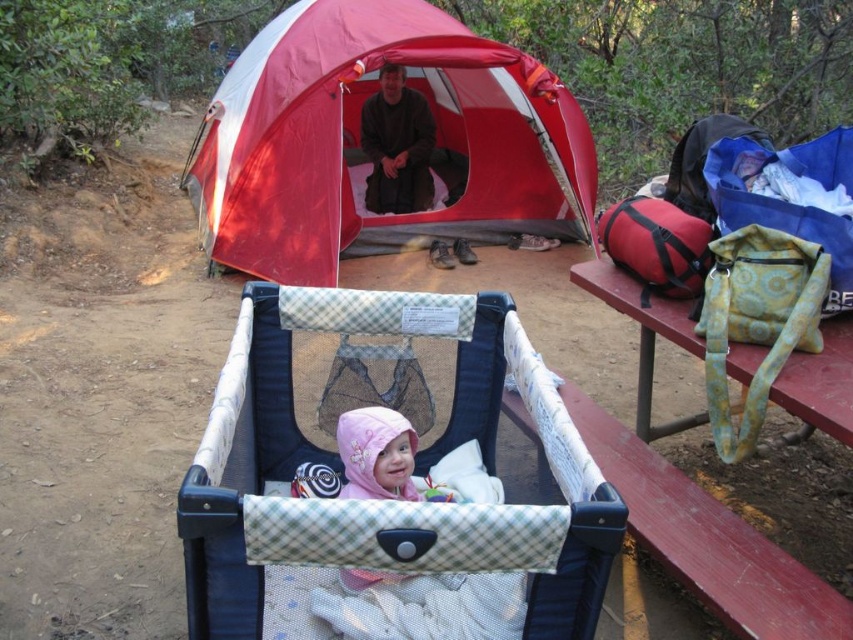
Question: Which object is positioned farthest from the blue fabric playpen at center?

Choices:
 (A) red/white fabric tent at upper center
 (B) wooden picnic table at right

Answer: (A)

Question: Which object is the closest to the wooden picnic table at right?

Choices:
 (A) red/white fabric tent at upper center
 (B) blue fabric playpen at center

Answer: (B)

Question: Considering the real-world distances, which object is closest to the wooden picnic table at right?

Choices:
 (A) red/white fabric tent at upper center
 (B) blue fabric playpen at center

Answer: (B)

Question: Does blue fabric playpen at center have a greater width compared to red/white fabric tent at upper center?

Choices:
 (A) no
 (B) yes

Answer: (A)

Question: In this image, where is blue fabric playpen at center located relative to red/white fabric tent at upper center?

Choices:
 (A) above
 (B) below

Answer: (B)

Question: From the image, what is the correct spatial relationship of blue fabric playpen at center in relation to red/white fabric tent at upper center?

Choices:
 (A) above
 (B) below

Answer: (B)